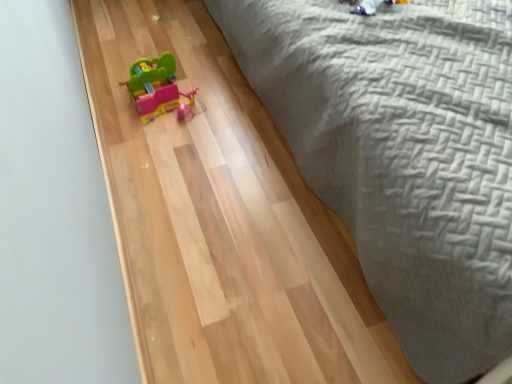
This screenshot has width=512, height=384. I want to click on free space to the left of matte plastic toy car at center, so click(x=111, y=92).